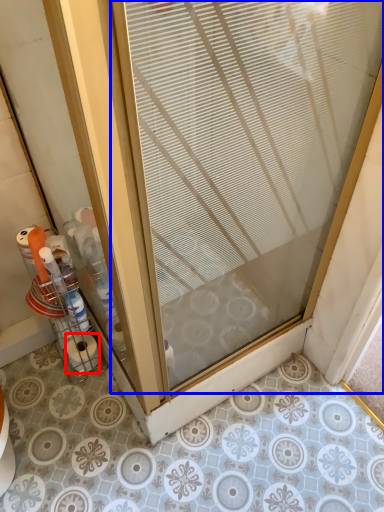
Question: Which object appears farthest to the camera in this image, toilet paper (highlighted by a red box) or door (highlighted by a blue box)?

Choices:
 (A) toilet paper
 (B) door

Answer: (A)